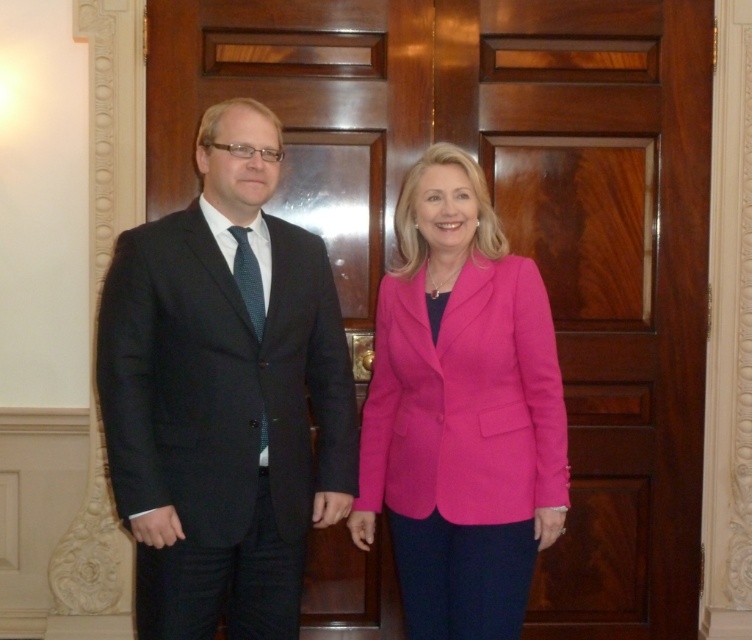
Question: Which object is closer to the camera taking this photo?

Choices:
 (A) pink fabric jacket at center
 (B) matte black suit at left

Answer: (B)

Question: Is matte black suit at left above pink fabric jacket at center?

Choices:
 (A) no
 (B) yes

Answer: (B)

Question: Can you confirm if matte black suit at left is positioned below pink fabric jacket at center?

Choices:
 (A) yes
 (B) no

Answer: (B)

Question: Does matte black suit at left appear on the left side of pink fabric jacket at center?

Choices:
 (A) yes
 (B) no

Answer: (A)

Question: Which object appears closest to the camera in this image?

Choices:
 (A) matte black suit at left
 (B) pink fabric jacket at center

Answer: (A)

Question: Which point appears farthest from the camera in this image?

Choices:
 (A) (299, 412)
 (B) (420, 280)

Answer: (B)